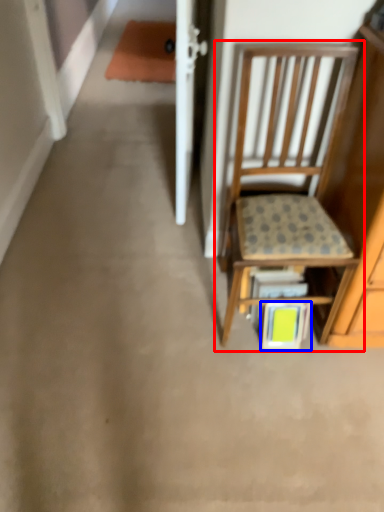
Question: Which object is further to the camera taking this photo, chair (highlighted by a red box) or book (highlighted by a blue box)?

Choices:
 (A) chair
 (B) book

Answer: (B)